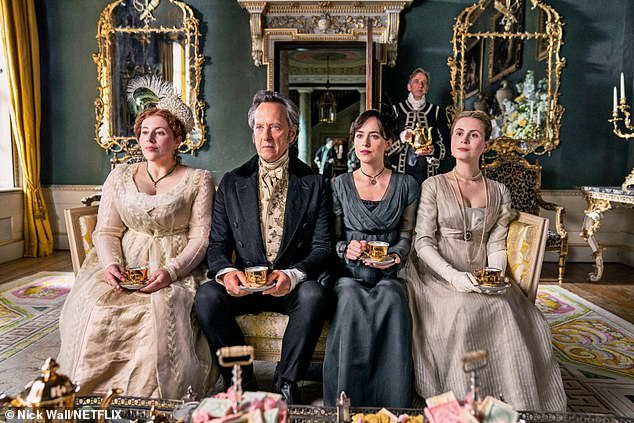
This screenshot has width=634, height=423. I want to click on sofa, so click(259, 332).